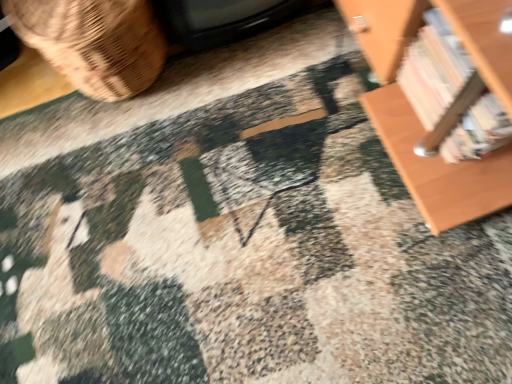
I want to click on wooden bookshelf at upper right, so click(x=450, y=96).

What do you see at coordinates (450, 96) in the screenshot?
I see `wooden bookshelf at upper right` at bounding box center [450, 96].

I want to click on brown woven basket at left, so click(x=94, y=42).

This screenshot has height=384, width=512. What do you see at coordinates (94, 42) in the screenshot? I see `brown woven basket at left` at bounding box center [94, 42].

You are a GUI agent. You are given a task and a screenshot of the screen. Output one action in this format:
    pyautogui.click(x=<x>, y=<y>)
    Task: Click on the wooden bookshelf at upper right
    Image resolution: width=512 pixels, height=384 pixels.
    Given the screenshot: What is the action you would take?
    pyautogui.click(x=450, y=96)

Is brown woven basket at left to the left or to the right of wooden bookshelf at upper right in the image?

From the image, it's evident that brown woven basket at left is to the left of wooden bookshelf at upper right.

Is brown woven basket at left closer to the viewer compared to wooden bookshelf at upper right?

No, the depth of brown woven basket at left is greater than that of wooden bookshelf at upper right.

Is point (17, 28) more distant than point (407, 93)?

No, it is not.

From the image's perspective, which is below, brown woven basket at left or wooden bookshelf at upper right?

wooden bookshelf at upper right, from the image's perspective.

From a real-world perspective, which object stands above the other?

brown woven basket at left is physically above.

Can you confirm if brown woven basket at left is thinner than wooden bookshelf at upper right?

Incorrect, the width of brown woven basket at left is not less than that of wooden bookshelf at upper right.

Does brown woven basket at left have a lesser height compared to wooden bookshelf at upper right?

Incorrect, the height of brown woven basket at left does not fall short of that of wooden bookshelf at upper right.

Considering the sizes of objects brown woven basket at left and wooden bookshelf at upper right in the image provided, who is bigger, brown woven basket at left or wooden bookshelf at upper right?

brown woven basket at left.

Is brown woven basket at left inside or outside of wooden bookshelf at upper right?

brown woven basket at left is outside wooden bookshelf at upper right.

Would you say brown woven basket at left is a long distance from wooden bookshelf at upper right?

brown woven basket at left is actually quite close to wooden bookshelf at upper right.

Is brown woven basket at left aimed at wooden bookshelf at upper right?

No, brown woven basket at left is not turned towards wooden bookshelf at upper right.

Can you tell me how much brown woven basket at left and wooden bookshelf at upper right differ in facing direction?

There is a 86.3-degree angle between the facing directions of brown woven basket at left and wooden bookshelf at upper right.

The width and height of the screenshot is (512, 384). What are the coordinates of `basket lying on the left of wooden bookshelf at upper right` in the screenshot? It's located at (94, 42).

Between wooden bookshelf at upper right and brown woven basket at left, which one appears on the left side from the viewer's perspective?

brown woven basket at left.

Is wooden bookshelf at upper right in front of or behind brown woven basket at left in the image?

wooden bookshelf at upper right is positioned closer to the viewer than brown woven basket at left.

Which point is more forward, (496, 117) or (66, 54)?

Positioned in front is point (496, 117).

From the image's perspective, is wooden bookshelf at upper right beneath brown woven basket at left?

Yes, from the image's perspective, wooden bookshelf at upper right is below brown woven basket at left.

From a real-world perspective, relative to brown woven basket at left, is wooden bookshelf at upper right vertically above or below?

From a real-world perspective, wooden bookshelf at upper right is physically below brown woven basket at left.

Considering the relative sizes of wooden bookshelf at upper right and brown woven basket at left in the image provided, is wooden bookshelf at upper right thinner than brown woven basket at left?

Yes, wooden bookshelf at upper right is thinner than brown woven basket at left.

From their relative heights in the image, would you say wooden bookshelf at upper right is taller or shorter than brown woven basket at left?

In the image, wooden bookshelf at upper right appears to be shorter than brown woven basket at left.

Consider the image. Looking at the image, does wooden bookshelf at upper right seem bigger or smaller compared to brown woven basket at left?

Considering their sizes, wooden bookshelf at upper right takes up less space than brown woven basket at left.

Is wooden bookshelf at upper right inside the boundaries of brown woven basket at left, or outside?

wooden bookshelf at upper right is outside brown woven basket at left.

In the scene shown: Can you see wooden bookshelf at upper right touching brown woven basket at left?

No, wooden bookshelf at upper right is not touching brown woven basket at left.

Is brown woven basket at left at the back of wooden bookshelf at upper right?

That's not correct — wooden bookshelf at upper right is not looking away from brown woven basket at left.

Looking at this image, how many degrees apart are the facing directions of wooden bookshelf at upper right and brown woven basket at left?

They differ by 86.3 degrees in their facing directions.

You are a GUI agent. You are given a task and a screenshot of the screen. Output one action in this format:
    pyautogui.click(x=<x>, y=<y>)
    Task: Click on the basket above the wooden bookshelf at upper right (from the image's perspective)
    The height and width of the screenshot is (384, 512).
    Given the screenshot: What is the action you would take?
    pyautogui.click(x=94, y=42)

I want to click on book directly beneath the brown woven basket at left (from a real-world perspective), so click(x=450, y=96).

Where is `basket above the wooden bookshelf at upper right (from a real-world perspective)`? The height and width of the screenshot is (384, 512). basket above the wooden bookshelf at upper right (from a real-world perspective) is located at coordinates (94, 42).